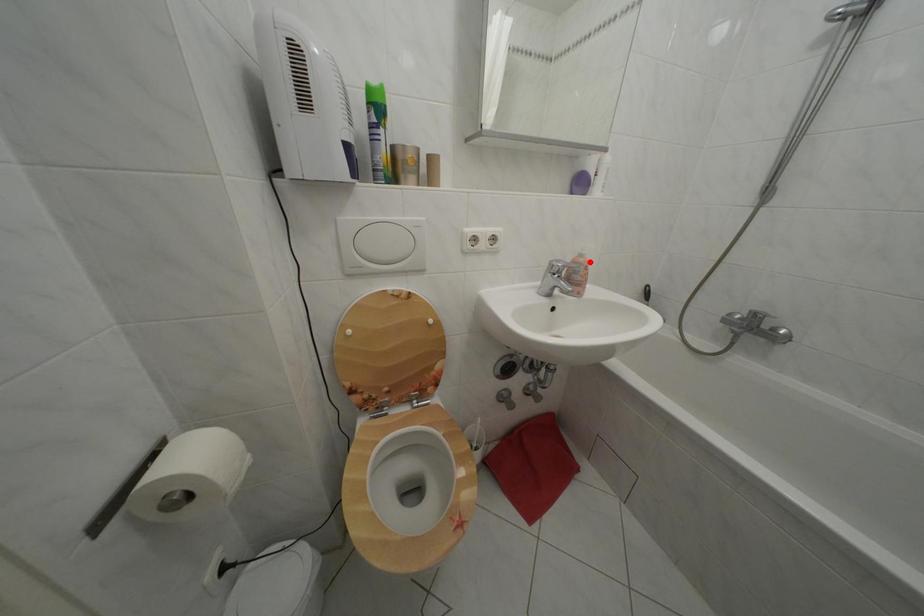
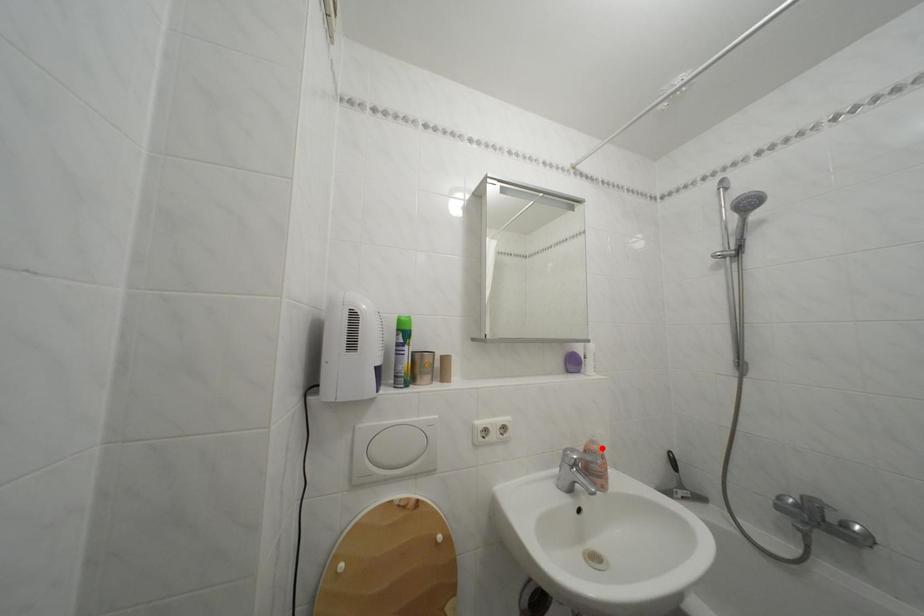
I am providing you with two images of the same scene from different viewpoints. A red point is marked on the first image and another point is marked on the second image. Do the highlighted points in image1 and image2 indicate the same real-world spot?

Yes